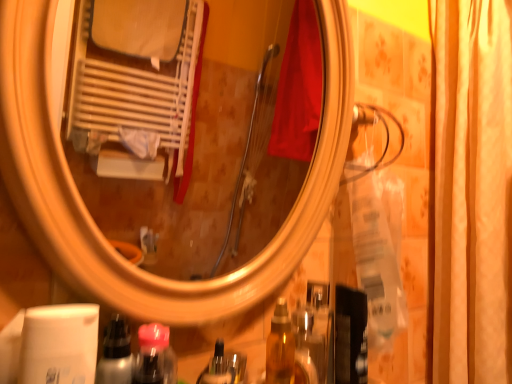
Question: From a real-world perspective, is silky beige curtain at right physically above metallic silver spray at lower left?

Choices:
 (A) yes
 (B) no

Answer: (A)

Question: Is silky beige curtain at right completely or partially outside of metallic silver spray at lower left?

Choices:
 (A) no
 (B) yes

Answer: (B)

Question: Is silky beige curtain at right thinner than metallic silver spray at lower left?

Choices:
 (A) no
 (B) yes

Answer: (A)

Question: Is silky beige curtain at right at the right side of metallic silver spray at lower left?

Choices:
 (A) yes
 (B) no

Answer: (A)

Question: Considering the relative sizes of silky beige curtain at right and metallic silver spray at lower left in the image provided, is silky beige curtain at right taller than metallic silver spray at lower left?

Choices:
 (A) yes
 (B) no

Answer: (A)

Question: From a real-world perspective, is metallic silver spray at lower left above or below silky beige curtain at right?

Choices:
 (A) below
 (B) above

Answer: (A)

Question: Is metallic silver spray at lower left spatially inside silky beige curtain at right, or outside of it?

Choices:
 (A) inside
 (B) outside

Answer: (B)

Question: From the image's perspective, is metallic silver spray at lower left above or below silky beige curtain at right?

Choices:
 (A) below
 (B) above

Answer: (A)

Question: Is metallic silver spray at lower left taller or shorter than silky beige curtain at right?

Choices:
 (A) short
 (B) tall

Answer: (A)

Question: From the image's perspective, is silky beige curtain at right above or below translucent plastic bottle at lower center?

Choices:
 (A) below
 (B) above

Answer: (B)

Question: Is point (437, 201) closer or farther from the camera than point (164, 352)?

Choices:
 (A) farther
 (B) closer

Answer: (A)

Question: Looking at their shapes, would you say silky beige curtain at right is wider or thinner than translucent plastic bottle at lower center?

Choices:
 (A) wide
 (B) thin

Answer: (A)

Question: Is silky beige curtain at right situated inside translucent plastic bottle at lower center or outside?

Choices:
 (A) outside
 (B) inside

Answer: (A)

Question: Is translucent plastic bottle at lower center in front of or behind silky beige curtain at right in the image?

Choices:
 (A) behind
 (B) front

Answer: (B)

Question: Considering the positions of translucent plastic bottle at lower center and silky beige curtain at right in the image, is translucent plastic bottle at lower center bigger or smaller than silky beige curtain at right?

Choices:
 (A) big
 (B) small

Answer: (B)